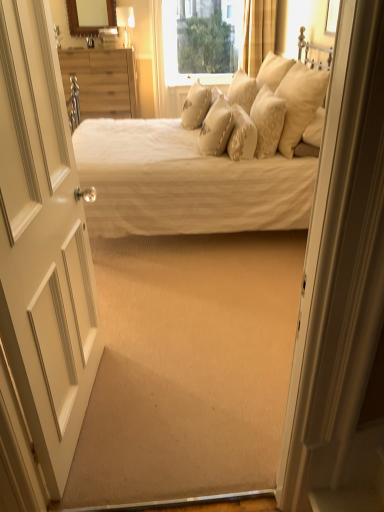
Find the location of a particular element. This screenshot has width=384, height=512. free location to the right of white wood door at left is located at coordinates (167, 398).